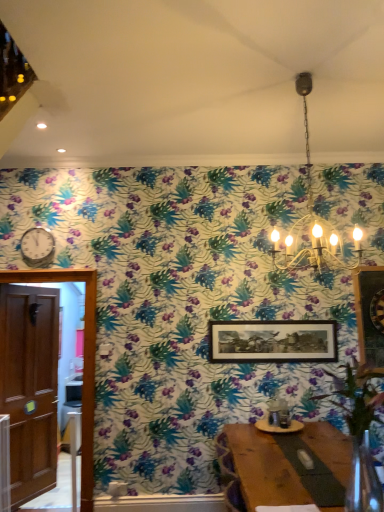
Question: Is metallic silver clock at left surrounded by wooden door at left?

Choices:
 (A) no
 (B) yes

Answer: (A)

Question: Is wooden door at left aimed at metallic silver clock at left?

Choices:
 (A) no
 (B) yes

Answer: (A)

Question: Does wooden door at left lie behind metallic silver clock at left?

Choices:
 (A) no
 (B) yes

Answer: (A)

Question: Is wooden door at left positioned beyond the bounds of metallic silver clock at left?

Choices:
 (A) no
 (B) yes

Answer: (B)

Question: Can you confirm if wooden door at left is shorter than metallic silver clock at left?

Choices:
 (A) no
 (B) yes

Answer: (A)

Question: Considering the relative positions of wooden door at left and metallic silver clock at left in the image provided, is wooden door at left to the right of metallic silver clock at left from the viewer's perspective?

Choices:
 (A) yes
 (B) no

Answer: (B)

Question: From the image's perspective, would you say metallic silver clock at left is shown under metallic chandelier at upper center?

Choices:
 (A) no
 (B) yes

Answer: (B)

Question: Is metallic silver clock at left outside of metallic chandelier at upper center?

Choices:
 (A) yes
 (B) no

Answer: (A)

Question: Is metallic silver clock at left facing towards metallic chandelier at upper center?

Choices:
 (A) no
 (B) yes

Answer: (A)

Question: Can you confirm if metallic silver clock at left is positioned to the right of metallic chandelier at upper center?

Choices:
 (A) yes
 (B) no

Answer: (B)

Question: Is metallic silver clock at left taller than metallic chandelier at upper center?

Choices:
 (A) yes
 (B) no

Answer: (B)

Question: Considering the relative sizes of metallic silver clock at left and metallic chandelier at upper center in the image provided, is metallic silver clock at left thinner than metallic chandelier at upper center?

Choices:
 (A) yes
 (B) no

Answer: (A)

Question: Considering the relative sizes of metallic silver clock at left and wooden door at left in the image provided, is metallic silver clock at left thinner than wooden door at left?

Choices:
 (A) no
 (B) yes

Answer: (B)